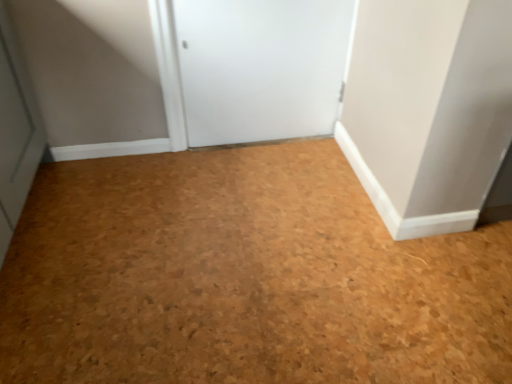
This screenshot has height=384, width=512. I want to click on free location in front of white matte door at center, so coord(262,195).